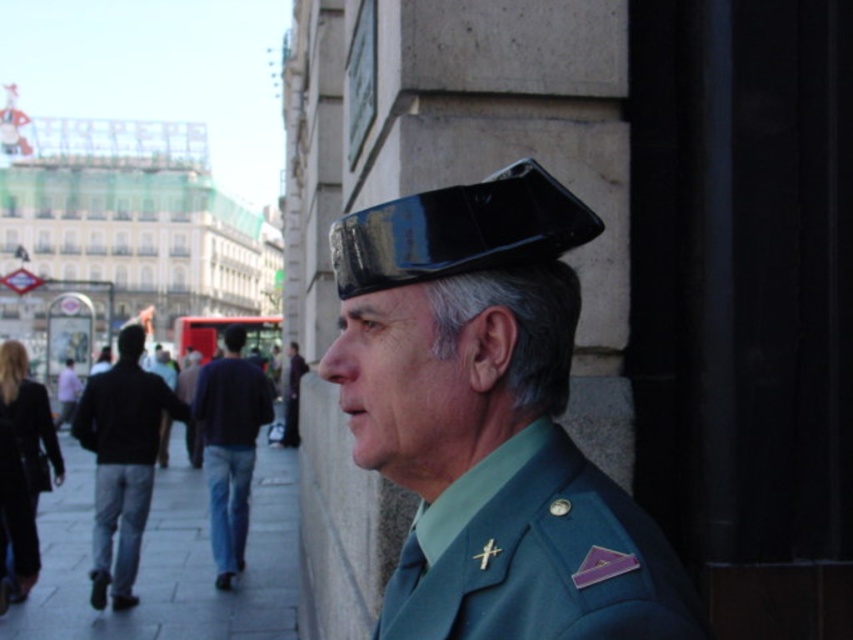
Is glossy black beret at center thinner than blue jeans at lower left?

Yes, glossy black beret at center is thinner than blue jeans at lower left.

Does point (563, 204) lie behind point (257, 396)?

No, (563, 204) is closer to viewer.

I want to click on glossy black beret at center, so click(x=489, y=420).

Can you confirm if gray concrete pavement at lower left is positioned to the right of black matte jacket at left?

Incorrect, gray concrete pavement at lower left is not on the right side of black matte jacket at left.

Locate an element on the screen. Image resolution: width=853 pixels, height=640 pixels. gray concrete pavement at lower left is located at coordinates (167, 560).

Find the location of `gray concrete pavement at lower left`. gray concrete pavement at lower left is located at coordinates (167, 560).

Which of these two, teal fabric uniform at center or black glossy hat at upper center, stands taller?

teal fabric uniform at center

Can you confirm if teal fabric uniform at center is smaller than black glossy hat at upper center?

No.

Where is `teal fabric uniform at center`? Image resolution: width=853 pixels, height=640 pixels. teal fabric uniform at center is located at coordinates (537, 556).

The height and width of the screenshot is (640, 853). In order to click on teal fabric uniform at center in this screenshot , I will do `click(537, 556)`.